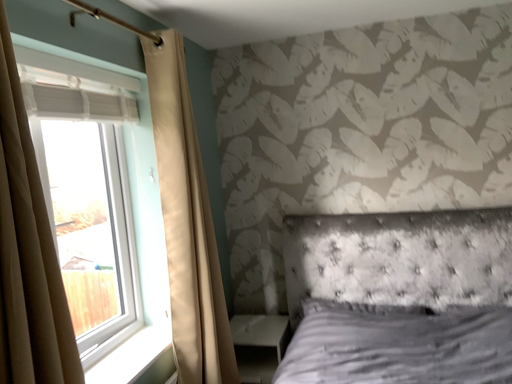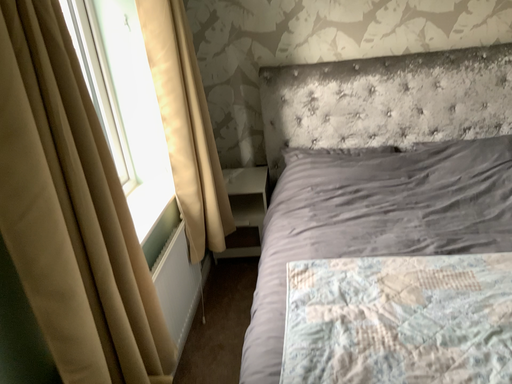
Question: How did the camera likely rotate when shooting the video?

Choices:
 (A) rotated right
 (B) rotated left

Answer: (A)